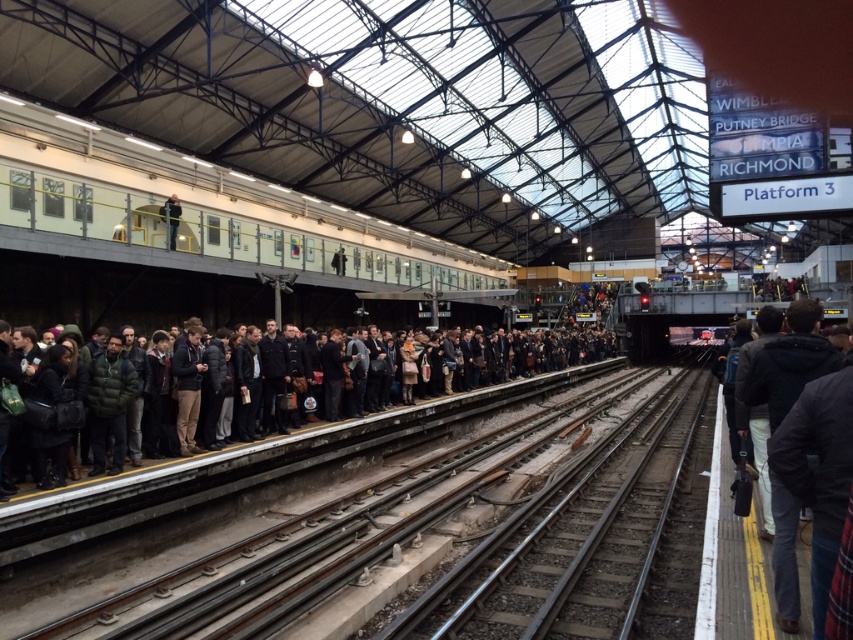
You are standing on the train station platform and want to reach a specific point marked at coordinates point (x=360, y=272). If your walking distance is limited to 100 feet, can you reach that point without moving further away?

The point (x=360, y=272) is 105.80 feet away from the viewer, which exceeds the 100 feet walking limit. Therefore, you cannot reach that point without moving further away.

You are a passenger waiting at the train station. You see the smooth concrete track at center and the dark gray clothing at center. Which object is closer to you as you stand on the platform?

The smooth concrete track at center is closer to you because it is in front of the dark gray clothing at center.

You are a passenger waiting on the platform and want to board the metallic silver train at upper center. The smooth concrete track at center is between you and the train. Can you walk directly to the train without stepping on the track?

The smooth concrete track at center is behind the metallic silver train at upper center, meaning the train is between you and the track. Therefore, you can walk directly to the train without stepping on the track.